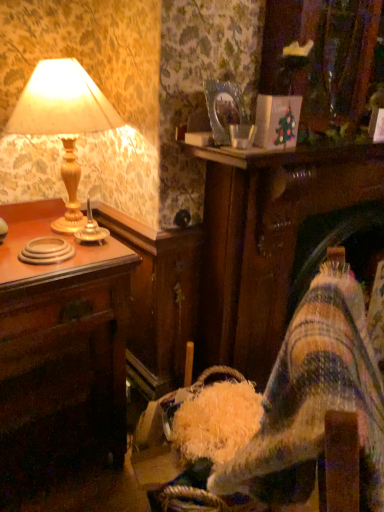
Question: Can you confirm if gold metallic candle holder at left is bigger than wooden desk at left?

Choices:
 (A) no
 (B) yes

Answer: (A)

Question: From the image's perspective, does gold metallic candle holder at left appear higher than wooden desk at left?

Choices:
 (A) yes
 (B) no

Answer: (A)

Question: Is gold metallic candle holder at left oriented away from wooden desk at left?

Choices:
 (A) no
 (B) yes

Answer: (A)

Question: Is gold metallic candle holder at left thinner than wooden desk at left?

Choices:
 (A) yes
 (B) no

Answer: (A)

Question: From a real-world perspective, is gold metallic candle holder at left positioned over wooden desk at left based on gravity?

Choices:
 (A) yes
 (B) no

Answer: (A)

Question: Considering the relative sizes of gold metallic candle holder at left and wooden desk at left in the image provided, is gold metallic candle holder at left smaller than wooden desk at left?

Choices:
 (A) no
 (B) yes

Answer: (B)

Question: Does gold metallic candle holder at left have a greater width compared to matte gold lamp at left?

Choices:
 (A) yes
 (B) no

Answer: (B)

Question: Considering the relative sizes of gold metallic candle holder at left and matte gold lamp at left in the image provided, is gold metallic candle holder at left taller than matte gold lamp at left?

Choices:
 (A) no
 (B) yes

Answer: (A)

Question: From the image's perspective, is gold metallic candle holder at left below matte gold lamp at left?

Choices:
 (A) yes
 (B) no

Answer: (A)

Question: From a real-world perspective, is gold metallic candle holder at left under matte gold lamp at left?

Choices:
 (A) no
 (B) yes

Answer: (B)

Question: Is gold metallic candle holder at left directly adjacent to matte gold lamp at left?

Choices:
 (A) no
 (B) yes

Answer: (A)

Question: Considering the relative sizes of gold metallic candle holder at left and matte gold lamp at left in the image provided, is gold metallic candle holder at left thinner than matte gold lamp at left?

Choices:
 (A) no
 (B) yes

Answer: (B)

Question: From the image's perspective, is wooden desk at left beneath gold metallic candle holder at left?

Choices:
 (A) yes
 (B) no

Answer: (A)